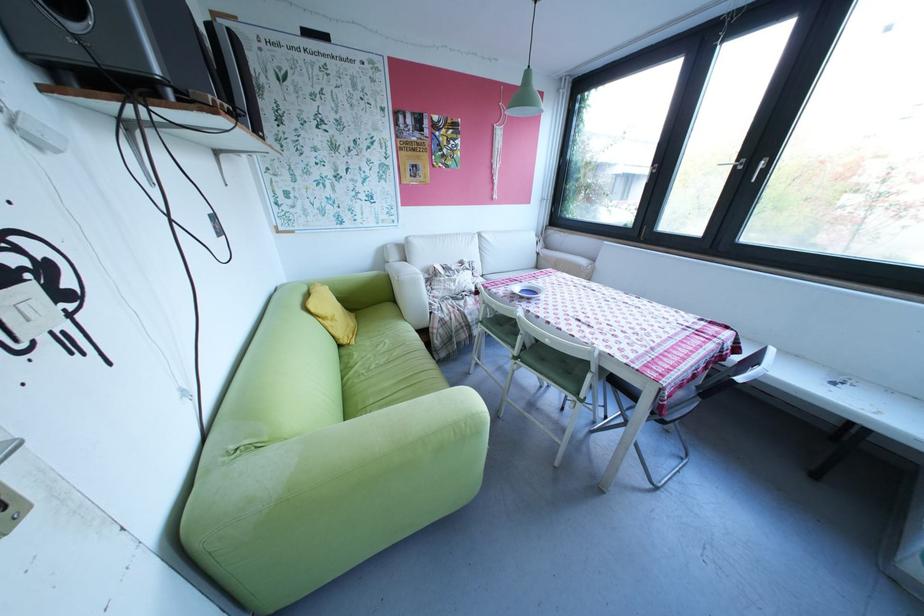
The image size is (924, 616). Describe the element at coordinates (555, 365) in the screenshot. I see `the green chair sitting surface` at that location.